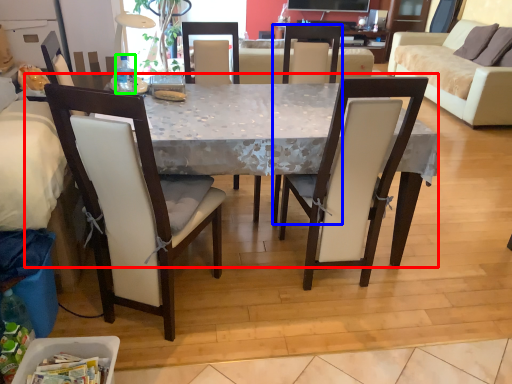
Question: Which object is positioned closest to desk (highlighted by a red box)? Select from chair (highlighted by a blue box) and bottle (highlighted by a green box).

Choices:
 (A) chair
 (B) bottle

Answer: (A)